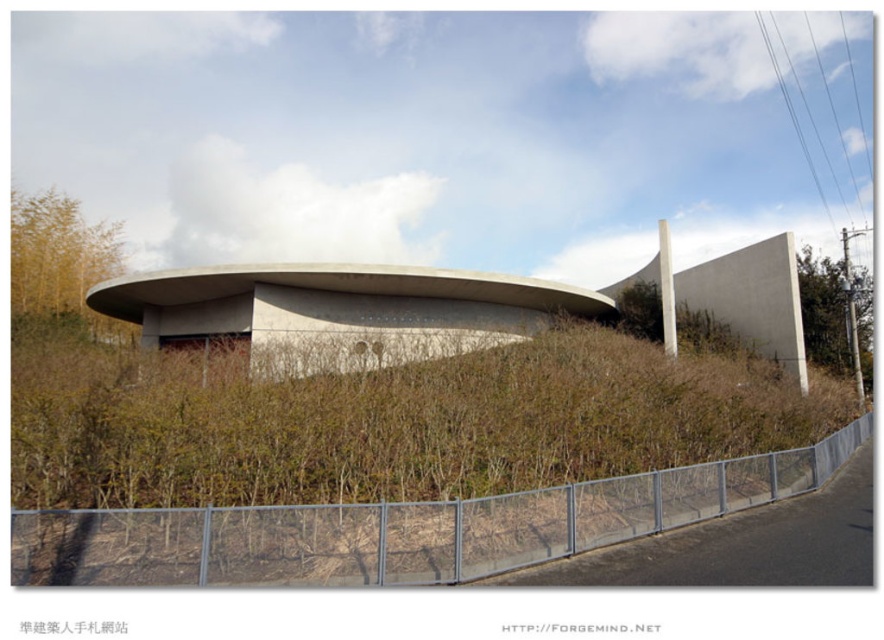
Does point (166, 573) come closer to viewer compared to point (558, 291)?

Yes.

Who is more distant from viewer, (222, 550) or (428, 278)?

Point (428, 278)

Where is `brown dry grass at center`? Image resolution: width=884 pixels, height=640 pixels. brown dry grass at center is located at coordinates (398, 461).